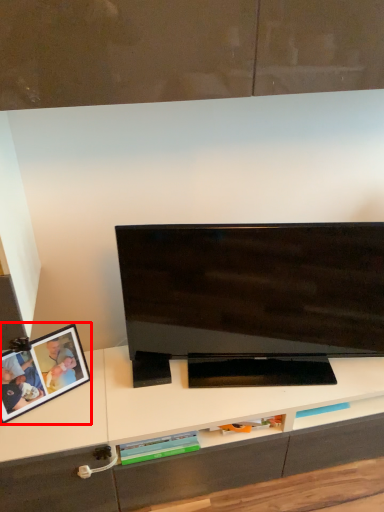
Question: Observing the image, what is the correct spatial positioning of picture frame (annotated by the red box) in reference to television?

Choices:
 (A) right
 (B) left

Answer: (B)